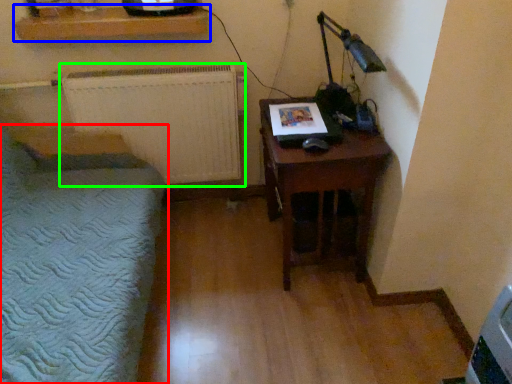
Question: Based on their relative distances, which object is farther from furniture (highlighted by a red box)? Choose from shelf (highlighted by a blue box) and radiator (highlighted by a green box).

Choices:
 (A) shelf
 (B) radiator

Answer: (A)